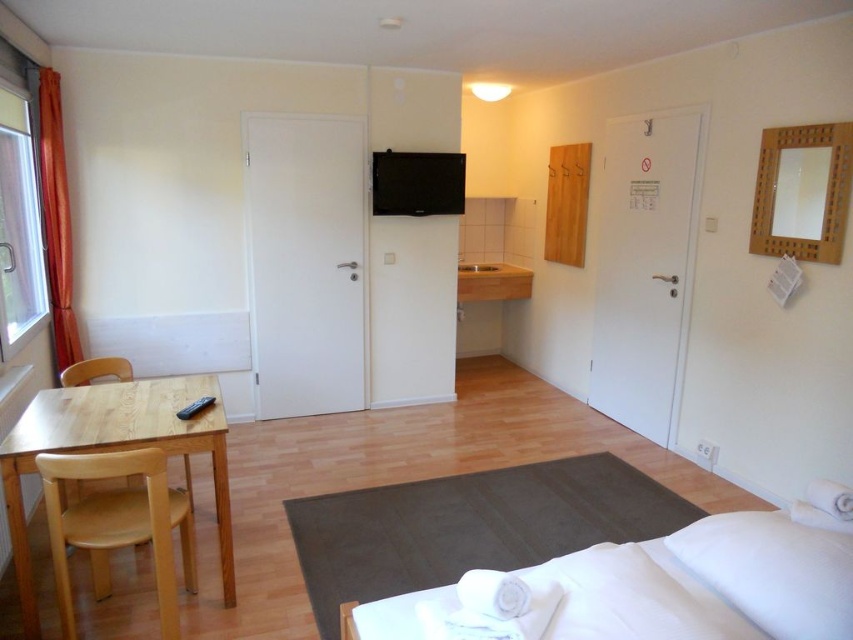
Image resolution: width=853 pixels, height=640 pixels. Describe the element at coordinates (469, 525) in the screenshot. I see `dark gray carpet at lower right` at that location.

Does dark gray carpet at lower right appear on the right side of white soft pillow at lower right?

Incorrect, dark gray carpet at lower right is not on the right side of white soft pillow at lower right.

The width and height of the screenshot is (853, 640). I want to click on dark gray carpet at lower right, so click(x=469, y=525).

Is point (474, 502) positioned before point (39, 412)?

That is False.

Who is more forward, (532, 525) or (189, 397)?

Point (189, 397) is in front.

Does point (390, 497) lie behind point (109, 388)?

Yes, it is.

Identify the location of dark gray carpet at lower right. This screenshot has width=853, height=640. (469, 525).

Does dark gray carpet at lower right appear under wooden chair at lower left?

Indeed, dark gray carpet at lower right is positioned under wooden chair at lower left.

Can you confirm if dark gray carpet at lower right is wider than wooden chair at lower left?

Yes, dark gray carpet at lower right is wider than wooden chair at lower left.

Is point (367, 580) more distant than point (170, 547)?

Yes, point (367, 580) is behind point (170, 547).

Locate an element on the screen. dark gray carpet at lower right is located at coordinates (469, 525).